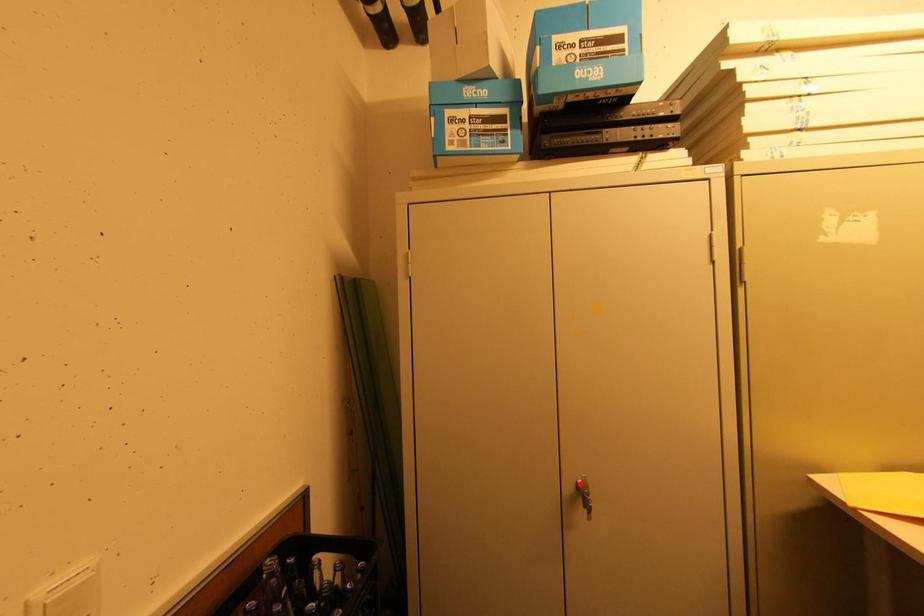
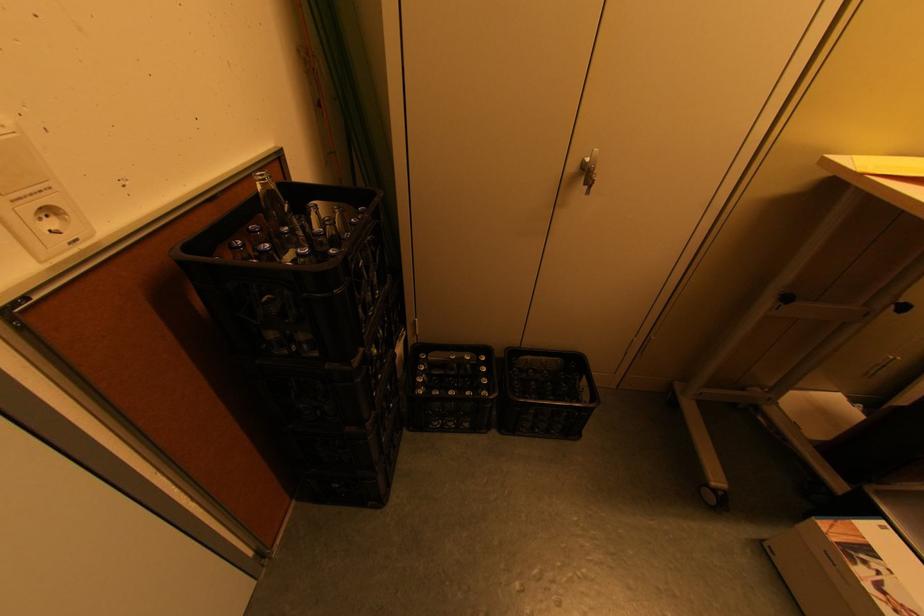
The point at the highlighted location is marked in the first image. Where is the corresponding point in the second image?

(587, 161)